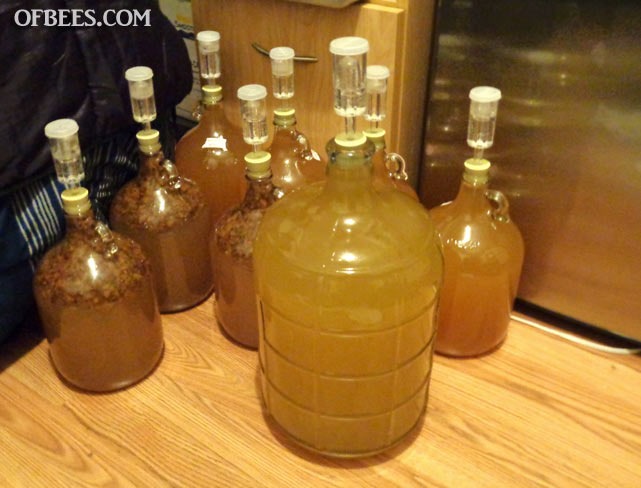
You are a GUI agent. You are given a task and a screenshot of the screen. Output one action in this format:
    pyautogui.click(x=<x>, y=<y>)
    Task: Click on the bottle
    
    Given the screenshot: What is the action you would take?
    pyautogui.click(x=401, y=184)